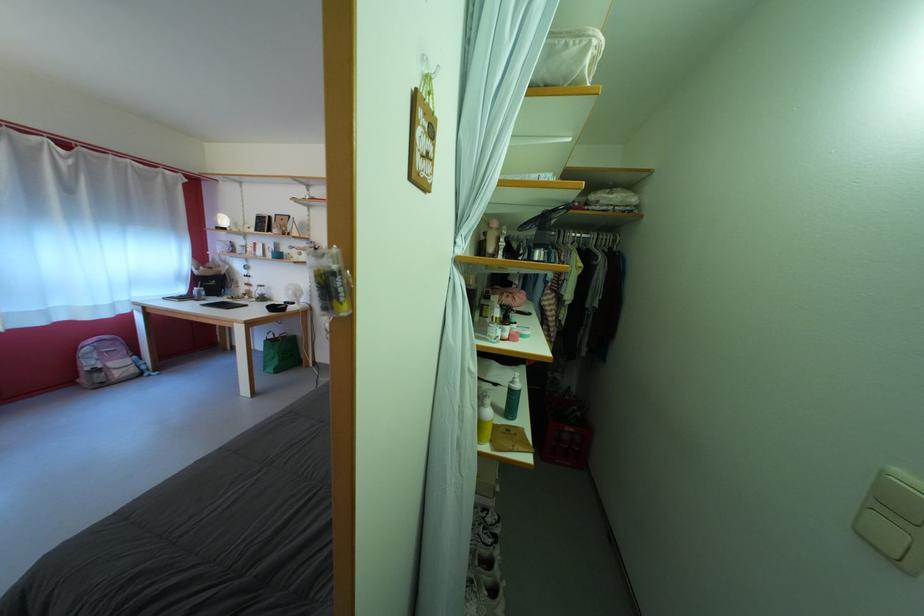
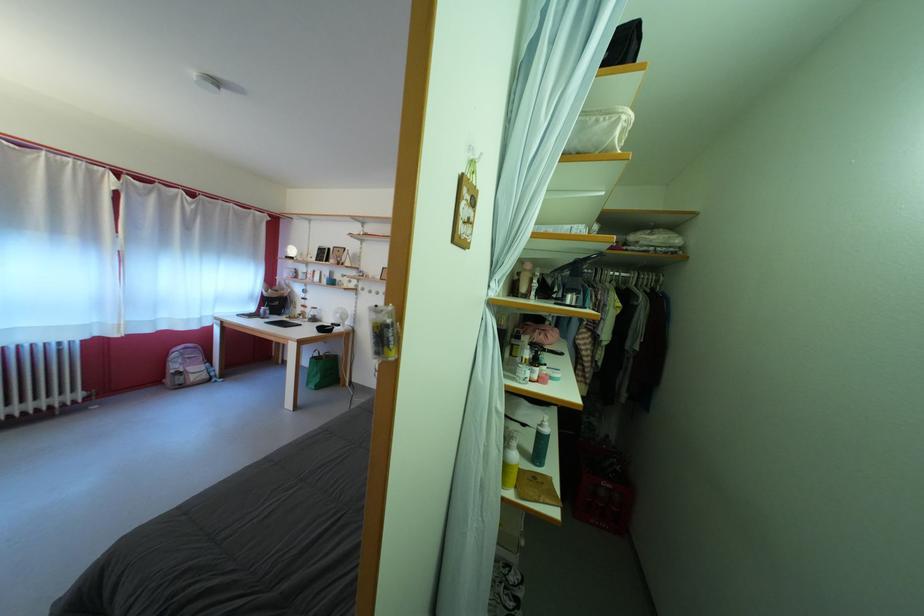
Question: Based on the continuous images, in which direction is the camera rotating? Reply with the corresponding letter.

Choices:
 (A) Left
 (B) Right
 (C) Up
 (D) Down

Answer: (A)